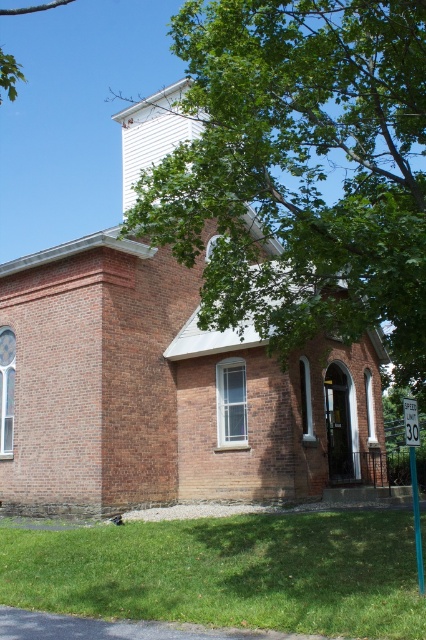
Is brick building at center wider than green leafy tree at upper center?

No.

Between brick building at center and green leafy tree at upper center, which one is positioned higher?

green leafy tree at upper center

Does point (291, 390) lie in front of point (219, 36)?

No, (291, 390) is further to viewer.

You are a GUI agent. You are given a task and a screenshot of the screen. Output one action in this format:
    pyautogui.click(x=<x>, y=<y>)
    Task: Click on the brick building at center
    
    Given the screenshot: What is the action you would take?
    pyautogui.click(x=164, y=392)